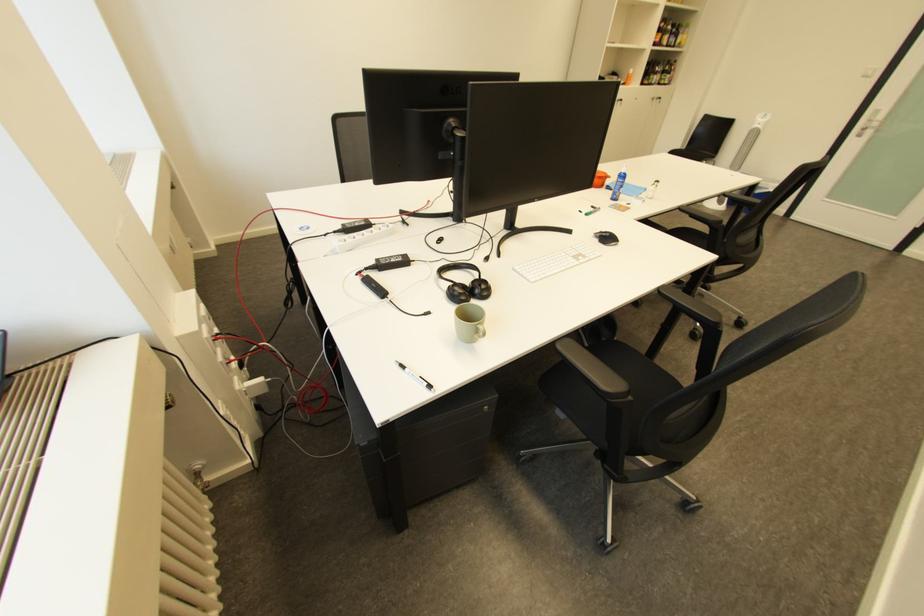
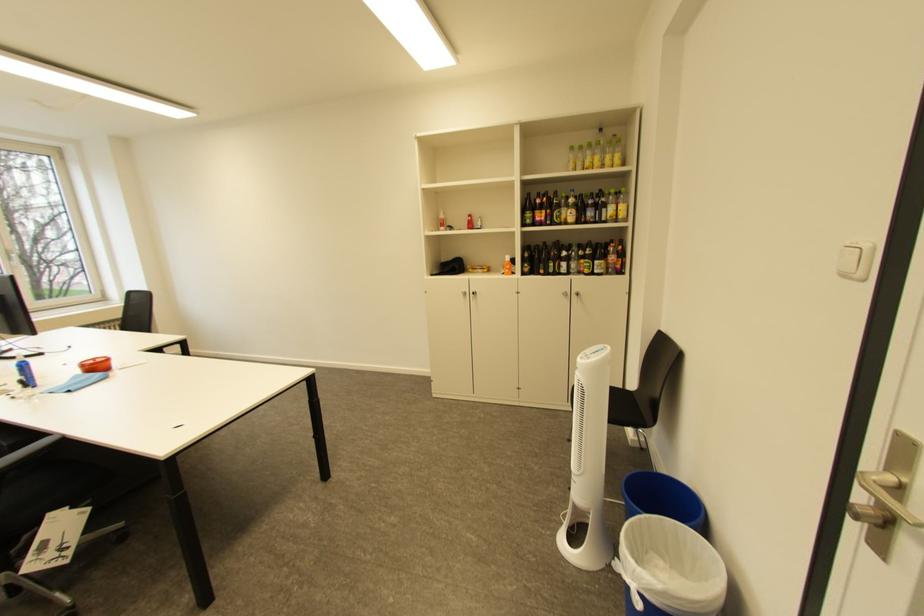
Find the pixel in the second image that matches pixel 676 46 in the first image.

(587, 224)